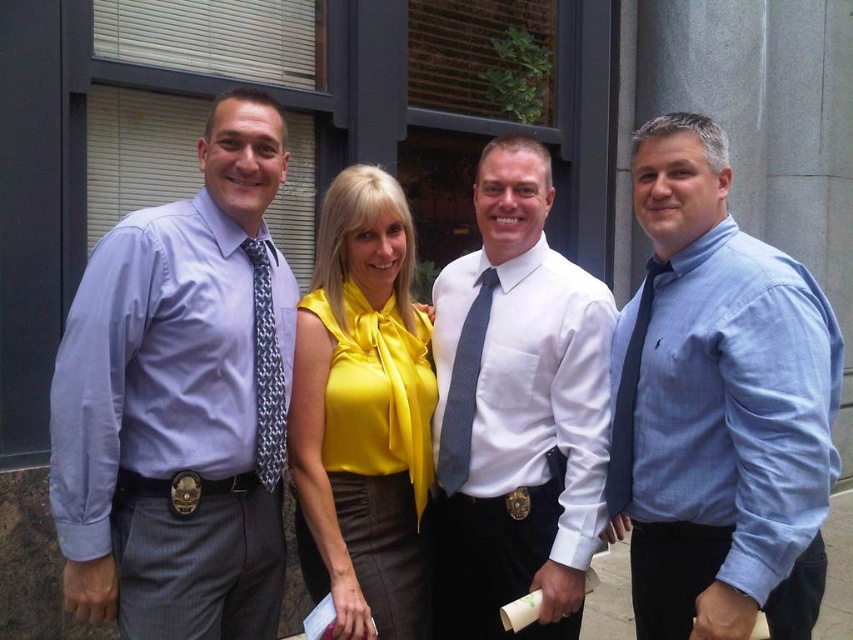
Who is lower down, blue cotton shirt at right or white smooth shirt at center?

white smooth shirt at center

Can you confirm if blue cotton shirt at right is positioned to the left of white smooth shirt at center?

In fact, blue cotton shirt at right is to the right of white smooth shirt at center.

Is point (799, 413) more distant than point (490, 314)?

No, (799, 413) is closer to viewer.

Identify the location of blue cotton shirt at right. (718, 406).

Between point (456, 433) and point (494, 276), which one is positioned behind?

Positioned behind is point (494, 276).

Who is lower down, white smooth shirt at center or dark gray textured tie at center?

white smooth shirt at center is below.

Identify the location of white smooth shirt at center. The image size is (853, 640). (515, 412).

Identify the location of white smooth shirt at center. (515, 412).

Can you confirm if blue cotton shirt at right is positioned to the right of gray textured tie at left?

Correct, you'll find blue cotton shirt at right to the right of gray textured tie at left.

Where is `blue cotton shirt at right`? The height and width of the screenshot is (640, 853). blue cotton shirt at right is located at coordinates (718, 406).